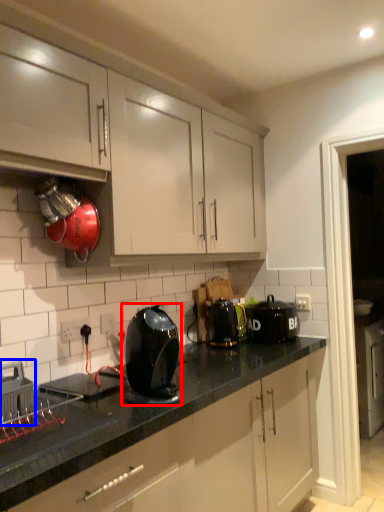
Question: Which point is closer to the camera, kitchen appliance (highlighted by a red box) or home appliance (highlighted by a blue box)?

Choices:
 (A) kitchen appliance
 (B) home appliance

Answer: (B)